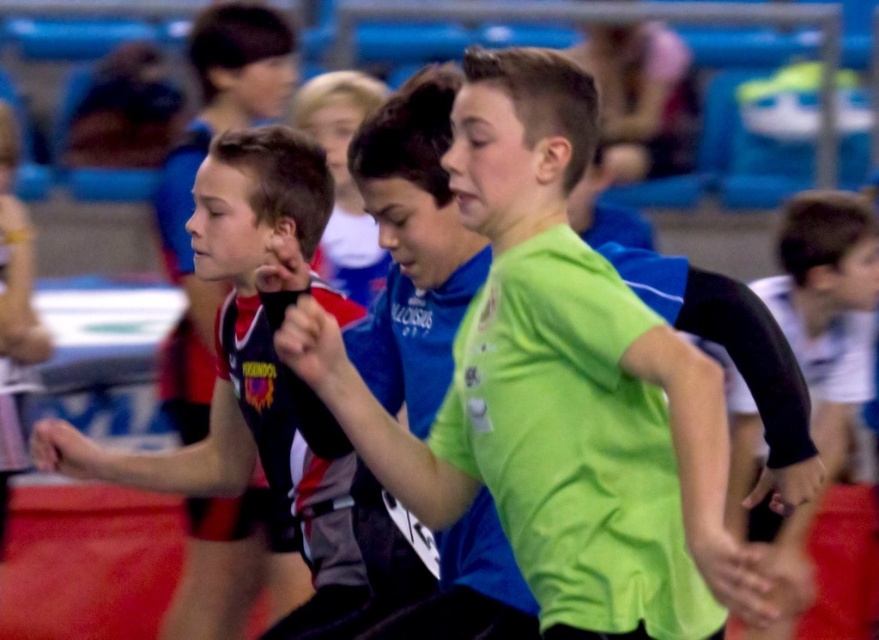
Can you confirm if neon green jersey at center is positioned above matte black jersey at left?

Indeed, neon green jersey at center is positioned over matte black jersey at left.

Who is shorter, neon green jersey at center or matte black jersey at left?

With less height is neon green jersey at center.

Locate an element on the screen. This screenshot has height=640, width=879. neon green jersey at center is located at coordinates (560, 388).

Identify the location of neon green jersey at center. (560, 388).